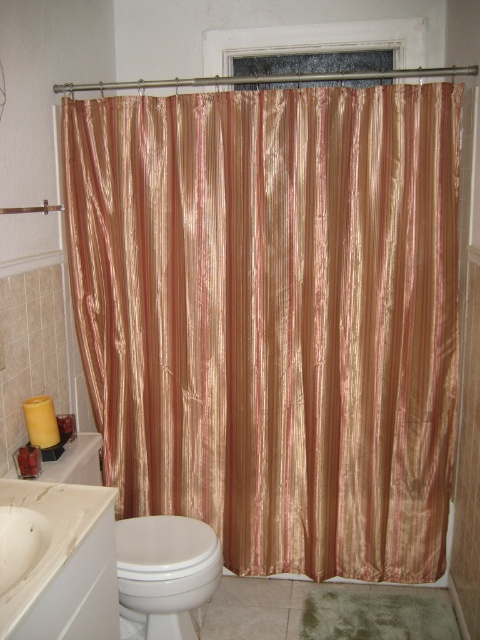
You are a cleaning robot with a width of 2 feet. You are positioned near the white glossy sink at lower left and want to move to the white toilet adjacent to the shower curtain. Can you pass through the space between them without touching either?

The distance between the white glossy sink at lower left and the white toilet adjacent to the shower curtain is 3.49 feet. Since your width is 2 feet, there is enough space to pass through without touching either.

You are organizing a bathroom cleaning schedule and need to know which object takes up more space in the bathroom. Based on the scene, which one is larger between the white glossy sink at lower left and the white glossy toilet bowl at lower left?

The white glossy toilet bowl at lower left is larger because it occupies more space than the white glossy sink at lower left.

You are a bathroom designer assessing the space. The shiny gold curtain at center and the white glossy toilet bowl at lower left are in view. Which object is significantly taller?

The shiny gold curtain at center is much taller than the white glossy toilet bowl at lower left.